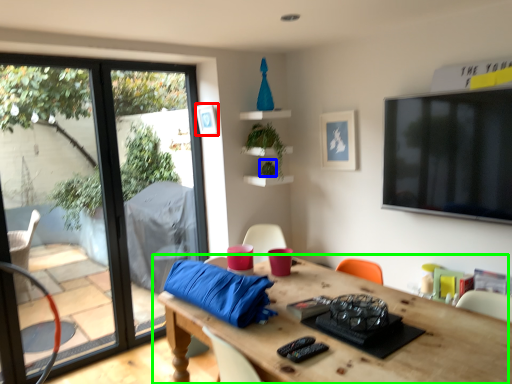
Question: Which is nearer to the picture frame (highlighted by a red box)? plant (highlighted by a blue box) or table (highlighted by a green box).

Choices:
 (A) plant
 (B) table

Answer: (A)